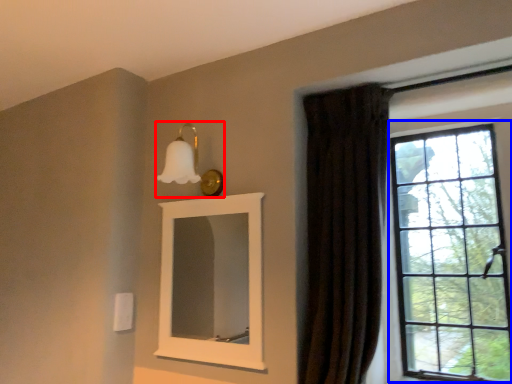
Question: Which of the following is the farthest to the observer, light fixture (highlighted by a red box) or window (highlighted by a blue box)?

Choices:
 (A) light fixture
 (B) window

Answer: (A)